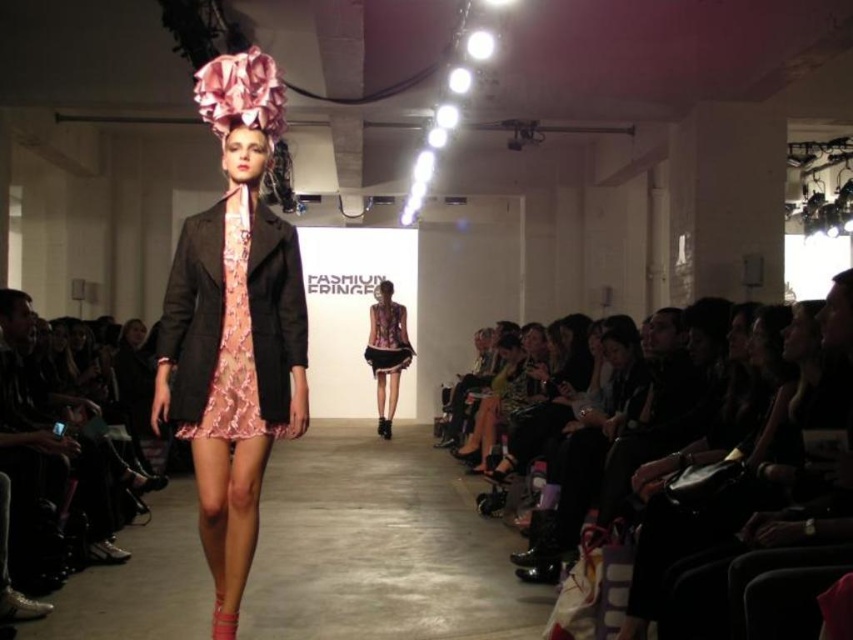
Question: Is black leather jacket at center bigger than metallic pink dress at center?

Choices:
 (A) yes
 (B) no

Answer: (A)

Question: Which object is positioned closest to the metallic pink dress at center?

Choices:
 (A) pink satin dress at center
 (B) black leather jacket at center
 (C) metallic sequined dress at center
 (D) pink floral dress at center

Answer: (C)

Question: Which point appears farthest from the camera in this image?

Choices:
 (A) (289, 288)
 (B) (792, 442)

Answer: (A)

Question: Is pink satin dress at center positioned in front of black leather jacket at center?

Choices:
 (A) no
 (B) yes

Answer: (A)

Question: Can you confirm if pink floral dress at center is positioned above metallic pink dress at center?

Choices:
 (A) no
 (B) yes

Answer: (B)

Question: Which point is farther to the camera?

Choices:
 (A) metallic pink dress at center
 (B) metallic sequined dress at center
 (C) pink floral dress at center
 (D) black leather jacket at center

Answer: (B)